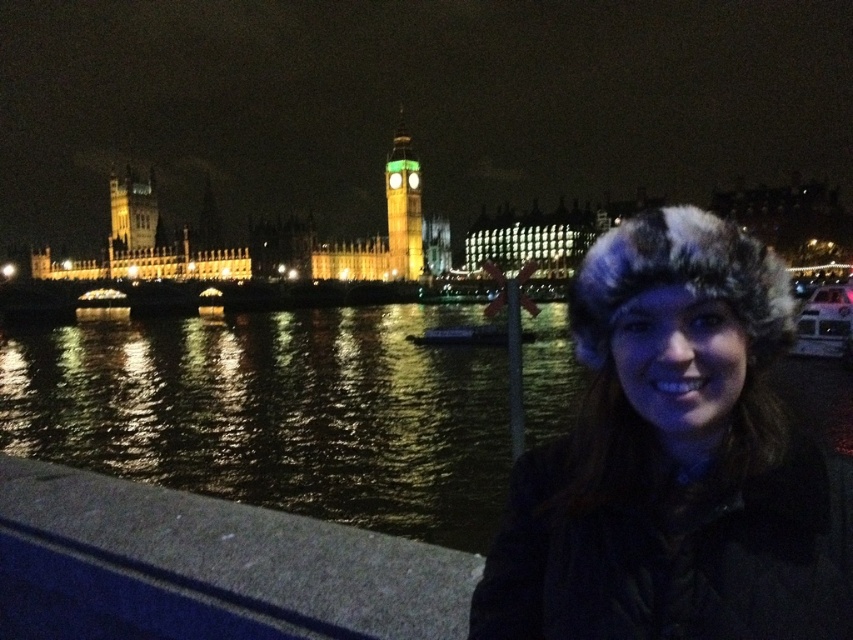
How much distance is there between fuzzy fur hat at lower right and green glass clock tower at center?

A distance of 47.59 meters exists between fuzzy fur hat at lower right and green glass clock tower at center.

Between fuzzy fur hat at lower right and green glass clock tower at center, which one appears on the left side from the viewer's perspective?

From the viewer's perspective, green glass clock tower at center appears more on the left side.

Measure the distance between point (497, 612) and camera.

They are 60.03 meters apart.

What are the coordinates of `fuzzy fur hat at lower right` in the screenshot? It's located at (674, 461).

Which is above, fuzzy fur hat at lower right or concrete at lower left?

fuzzy fur hat at lower right is higher up.

Does fuzzy fur hat at lower right have a lesser width compared to concrete at lower left?

Yes, fuzzy fur hat at lower right is thinner than concrete at lower left.

What do you see at coordinates (674, 461) in the screenshot?
I see `fuzzy fur hat at lower right` at bounding box center [674, 461].

At what (x,y) coordinates should I click in order to perform the action: click on fuzzy fur hat at lower right. Please return your answer as a coordinate pair (x, y). Image resolution: width=853 pixels, height=640 pixels. Looking at the image, I should click on click(674, 461).

Does glossy water at lower left appear on the right side of green glass clock tower at center?

In fact, glossy water at lower left is to the left of green glass clock tower at center.

Based on the photo, is glossy water at lower left bigger than green glass clock tower at center?

Indeed, glossy water at lower left has a larger size compared to green glass clock tower at center.

Which is behind, point (397, 451) or point (404, 257)?

Positioned behind is point (404, 257).

I want to click on glossy water at lower left, so click(x=276, y=412).